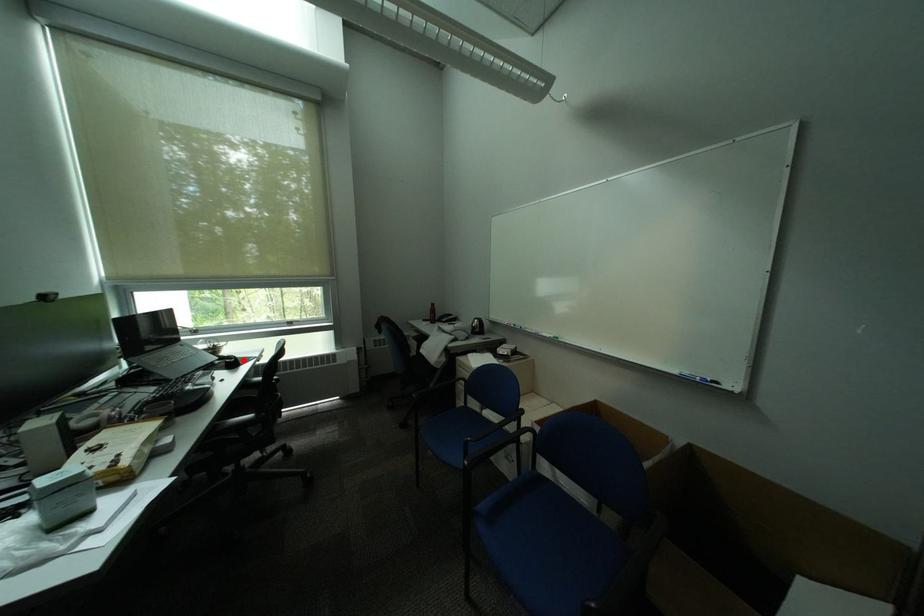
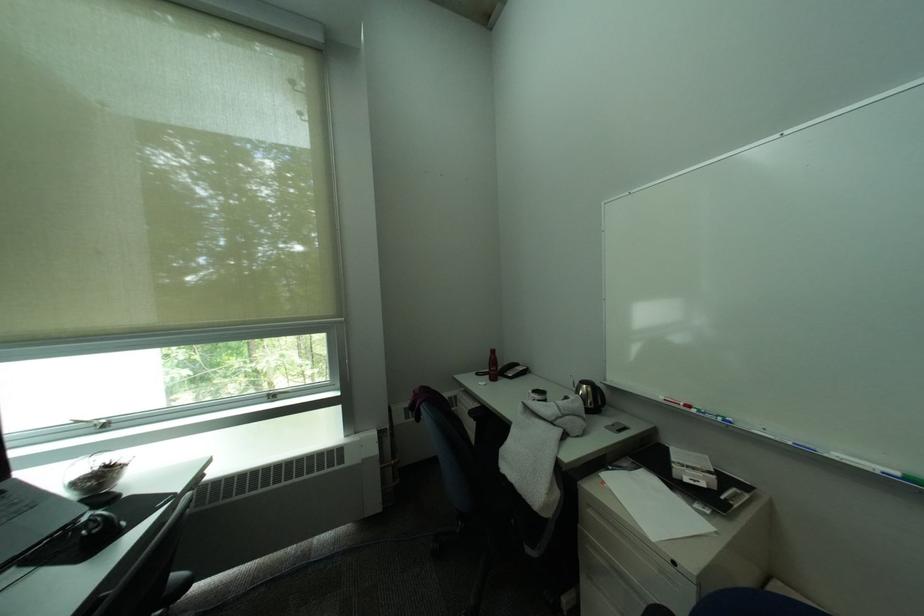
Question: I am providing you with two images of the same scene from different viewpoints. A red point is marked on the first image. At the location where the point appears in image 1, is it still visible in image 2?

Choices:
 (A) Yes
 (B) No

Answer: (A)